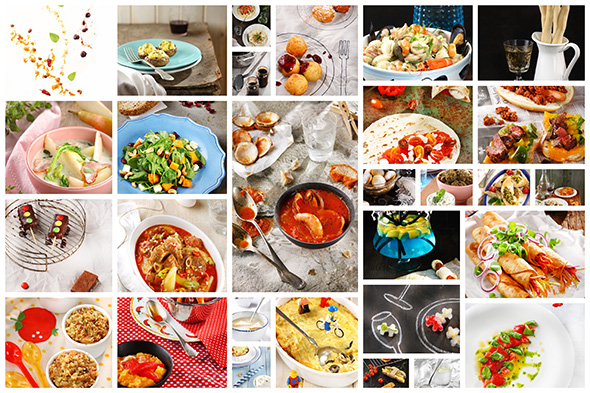
This screenshot has width=590, height=393. I want to click on bowls, so click(x=260, y=324), click(x=324, y=225), click(x=195, y=251), click(x=95, y=328), click(x=78, y=375), click(x=153, y=367), click(x=463, y=181), click(x=382, y=181), click(x=83, y=164).